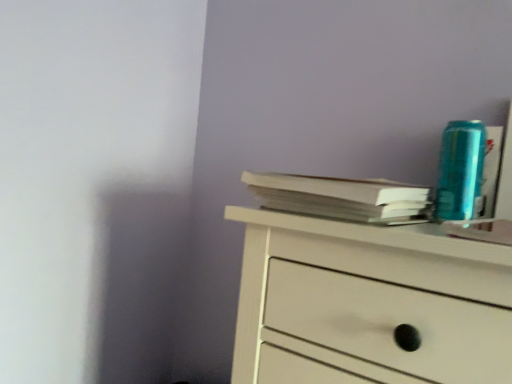
Question: Is point [279, 182] positioned closer to the camera than point [450, 196]?

Choices:
 (A) farther
 (B) closer

Answer: (B)

Question: From the image's perspective, relative to teal metallic can at upper right, is white paper at upper right above or below?

Choices:
 (A) above
 (B) below

Answer: (B)

Question: From a real-world perspective, is white paper at upper right above or below teal metallic can at upper right?

Choices:
 (A) above
 (B) below

Answer: (B)

Question: Considering the positions of teal metallic can at upper right and white paper at upper right in the image, is teal metallic can at upper right bigger or smaller than white paper at upper right?

Choices:
 (A) small
 (B) big

Answer: (A)

Question: Based on their positions, is teal metallic can at upper right located to the left or right of white paper at upper right?

Choices:
 (A) right
 (B) left

Answer: (A)

Question: Is point (442, 162) closer or farther from the camera than point (352, 203)?

Choices:
 (A) farther
 (B) closer

Answer: (A)

Question: Would you say teal metallic can at upper right is inside or outside white paper at upper right?

Choices:
 (A) outside
 (B) inside

Answer: (A)